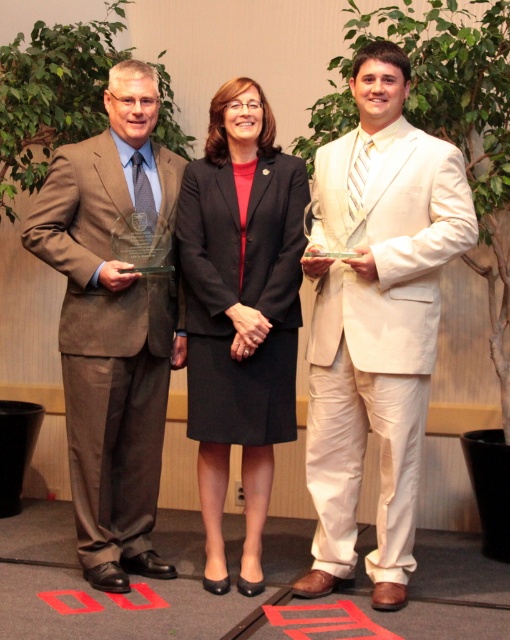
Can you confirm if white satin suit at center is thinner than black fabric skirt at center?

No.

Is white satin suit at center to the left of black fabric skirt at center from the viewer's perspective?

No, white satin suit at center is not to the left of black fabric skirt at center.

Who is more distant from viewer, [419,172] or [245,177]?

The point [245,177] is behind.

Where is `white satin suit at center`? white satin suit at center is located at coordinates (375, 320).

Between point (148, 570) and point (226, 112), which one is positioned in front?

Positioned in front is point (226, 112).

Identify the location of matte brown suit at left. (114, 326).

Is point (142, 561) closer to viewer compared to point (276, 410)?

No.

Where is `matte brown suit at left`? The image size is (510, 640). matte brown suit at left is located at coordinates (114, 326).

Can you confirm if white satin suit at center is smaller than matte brown suit at left?

Actually, white satin suit at center might be larger than matte brown suit at left.

Who is more forward, (374,61) or (86,212)?

Point (374,61) is in front.

Locate an element on the screen. The image size is (510, 640). white satin suit at center is located at coordinates (375, 320).